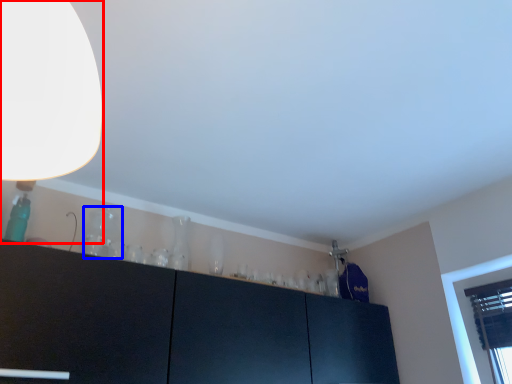
Question: Which object appears farthest to the camera in this image, lamp (highlighted by a red box) or glass vase (highlighted by a blue box)?

Choices:
 (A) lamp
 (B) glass vase

Answer: (B)